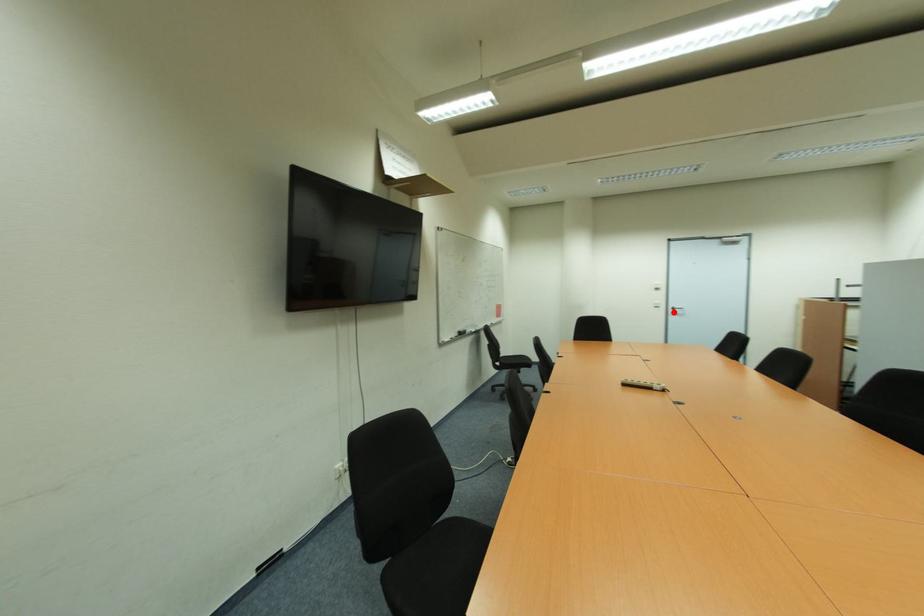
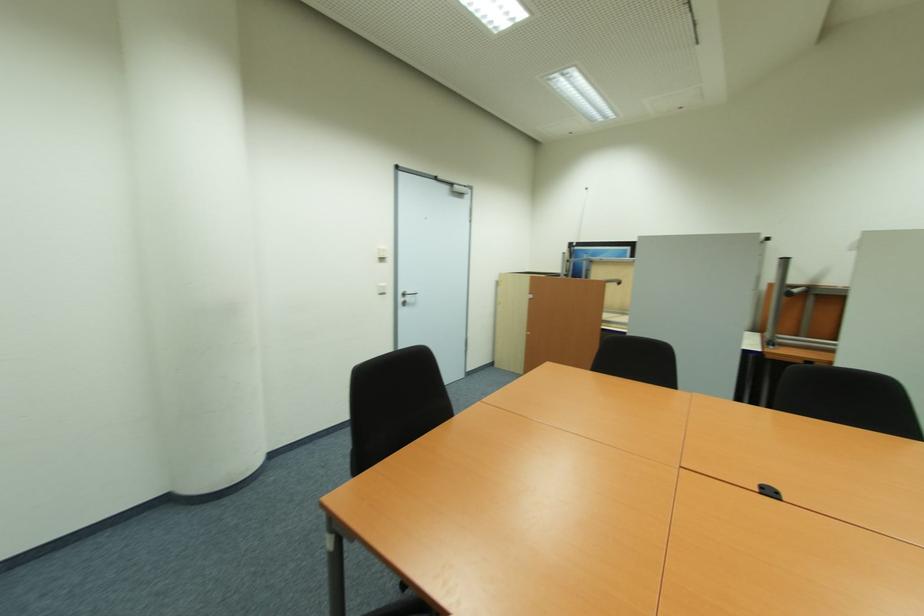
Question: I am providing you with two images of the same scene from different viewpoints. In image1, a red point is highlighted. Considering the same 3D point in image2, which of the following is correct?

Choices:
 (A) It is closer
 (B) It is farther

Answer: (A)